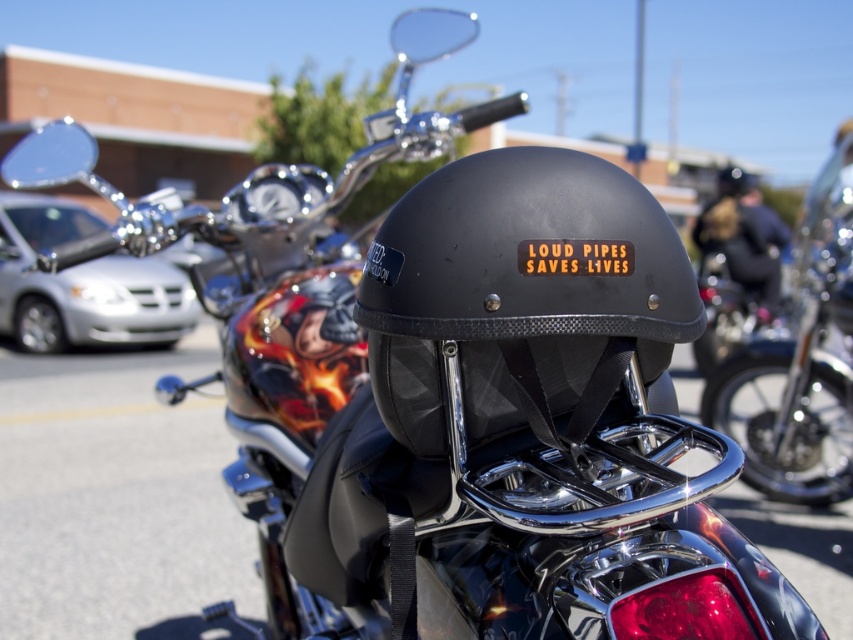
Can you confirm if matte black helmet at center is wider than shiny chrome motorcycle at center?

Result: In fact, matte black helmet at center might be narrower than shiny chrome motorcycle at center.

Image resolution: width=853 pixels, height=640 pixels. What do you see at coordinates (520, 292) in the screenshot?
I see `matte black helmet at center` at bounding box center [520, 292].

Identify the location of matte black helmet at center. This screenshot has width=853, height=640. (520, 292).

Is shiny chrome motorcycle at center smaller than matte black helmet at upper center?

No, shiny chrome motorcycle at center is not smaller than matte black helmet at upper center.

Is shiny chrome motorcycle at center further to the viewer compared to matte black helmet at upper center?

No.

Is point (833, 240) farther from viewer compared to point (770, 285)?

No, (833, 240) is closer to viewer.

Find the location of `shiny chrome motorcycle at center`. shiny chrome motorcycle at center is located at coordinates (799, 362).

Is the position of matte black helmet at center more distant than that of matte black helmet at upper center?

No.

Between point (674, 282) and point (749, 228), which one is positioned in front?

Point (674, 282) is in front.

Between point (405, 371) and point (773, 224), which one is positioned behind?

The point (773, 224) is more distant.

Locate an element on the screen. Image resolution: width=853 pixels, height=640 pixels. matte black helmet at center is located at coordinates (520, 292).